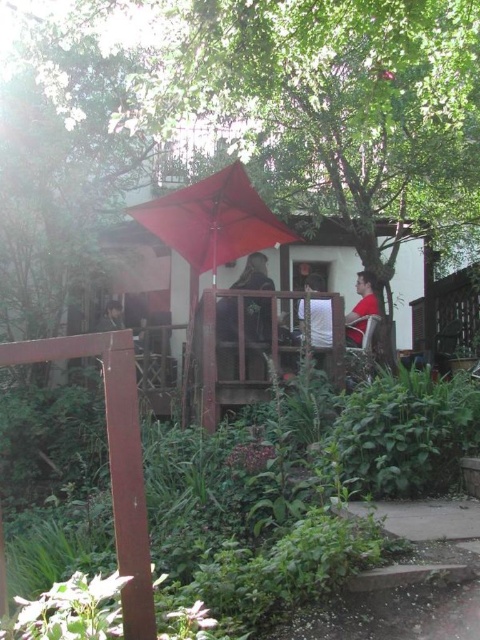
You are standing at point (325,106) in the garden. What object is located exactly at your current position?

The green leafy tree at upper center is located exactly at point (325,106).

You are standing at the point labeled point (325, 106) in the image. What object is directly in front of you?

The point (325, 106) corresponds to the green leafy tree at upper center, so the object directly in front of you is the green leafy tree at upper center.

You are a gardener who wants to plant a new tree in the garden. The green leafy tree at upper center is already there. If you want to plant a new tree 3 meters away from it, will there be enough space?

The existing distance between the green leafy tree at upper center and the new tree would be 3.58 meters, which is more than the required 3 meters. Therefore, there is sufficient space to plant the new tree at the desired distance.